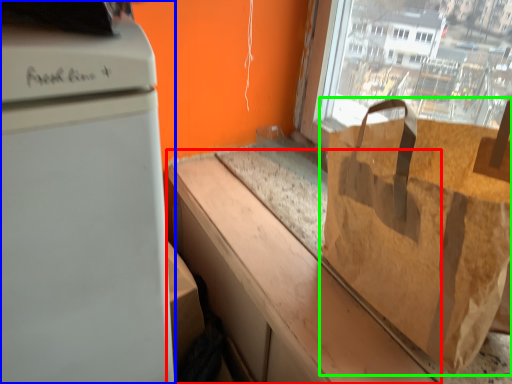
Question: Which object is positioned farthest from counter top (highlighted by a red box)? Select from home appliance (highlighted by a blue box) and grocery bag (highlighted by a green box).

Choices:
 (A) home appliance
 (B) grocery bag

Answer: (A)